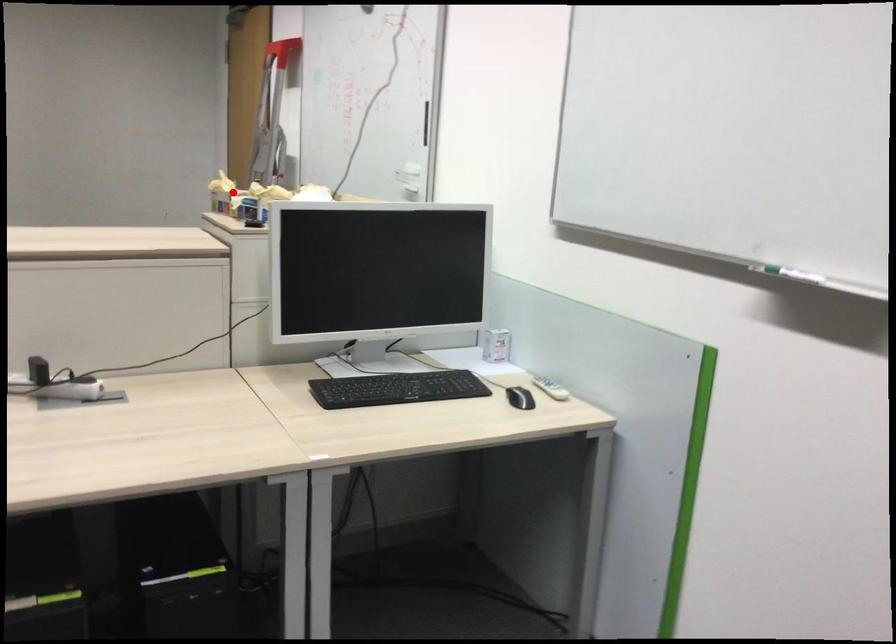
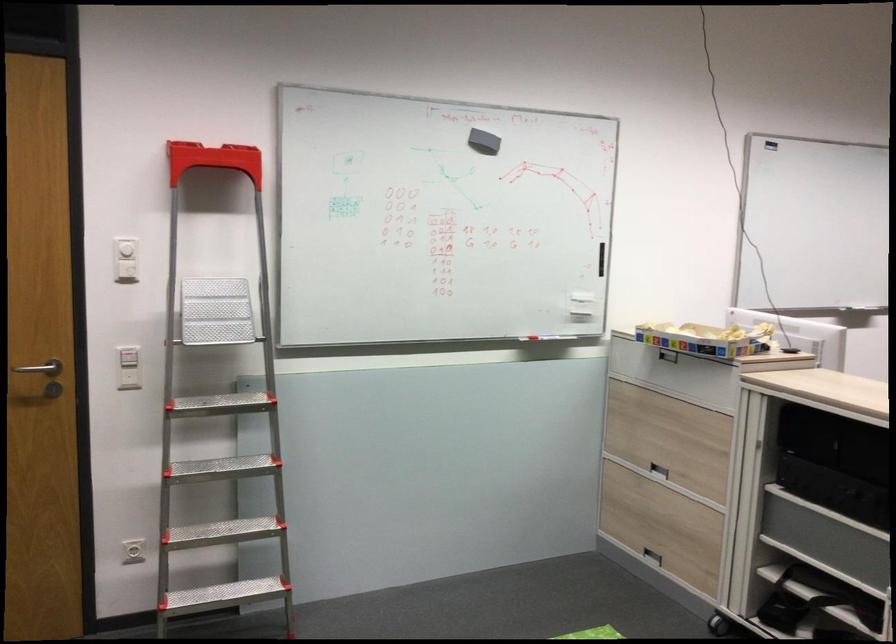
Find the pixel in the second image that matches the highlighted location in the first image.

(705, 339)